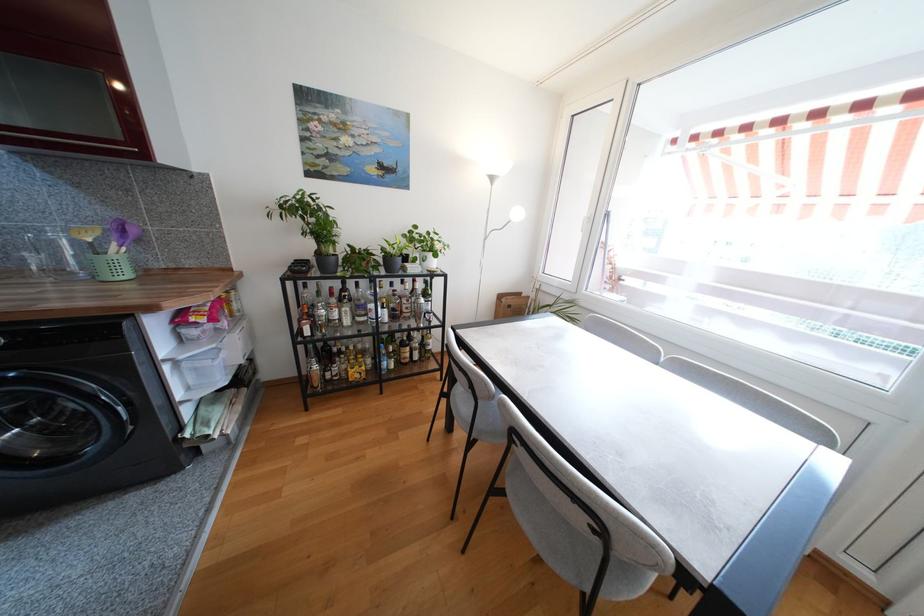
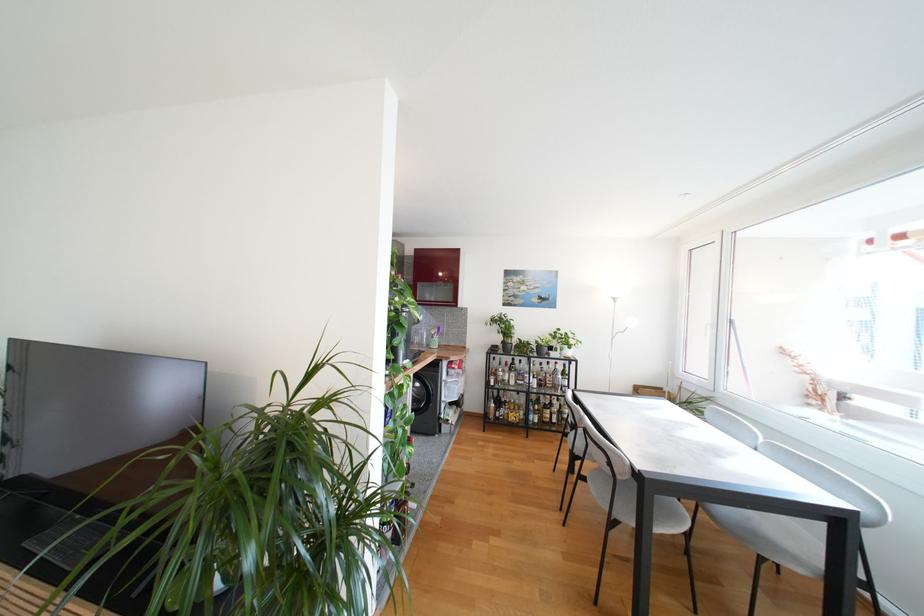
Find the pixel in the second image that matches [411,363] in the first image.

(553, 423)